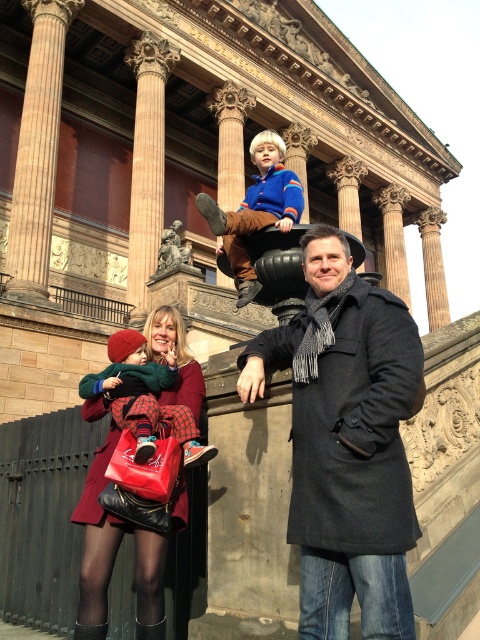
Which is more to the left, matte red coat at center or smooth stone column at center?

Positioned to the left is smooth stone column at center.

Does matte red coat at center have a larger size compared to smooth stone column at center?

Actually, matte red coat at center might be smaller than smooth stone column at center.

Is point (108, 513) farther from camera compared to point (24, 253)?

No.

Find the location of a particular element. matte red coat at center is located at coordinates (97, 524).

Can you confirm if knitted wool sweater at center is wider than velvety brown pants at upper center?

In fact, knitted wool sweater at center might be narrower than velvety brown pants at upper center.

Between knitted wool sweater at center and velvety brown pants at upper center, which one has less height?

With less height is knitted wool sweater at center.

The width and height of the screenshot is (480, 640). Find the location of `knitted wool sweater at center`. knitted wool sweater at center is located at coordinates [x=144, y=397].

Does dark gray wool coat at center have a lesser width compared to brown polished stone column at upper center?

No.

Based on the photo, between dark gray wool coat at center and brown polished stone column at upper center, which one is positioned higher?

Positioned higher is brown polished stone column at upper center.

The width and height of the screenshot is (480, 640). Describe the element at coordinates (347, 442) in the screenshot. I see `dark gray wool coat at center` at that location.

The height and width of the screenshot is (640, 480). Find the location of `dark gray wool coat at center`. dark gray wool coat at center is located at coordinates pos(347,442).